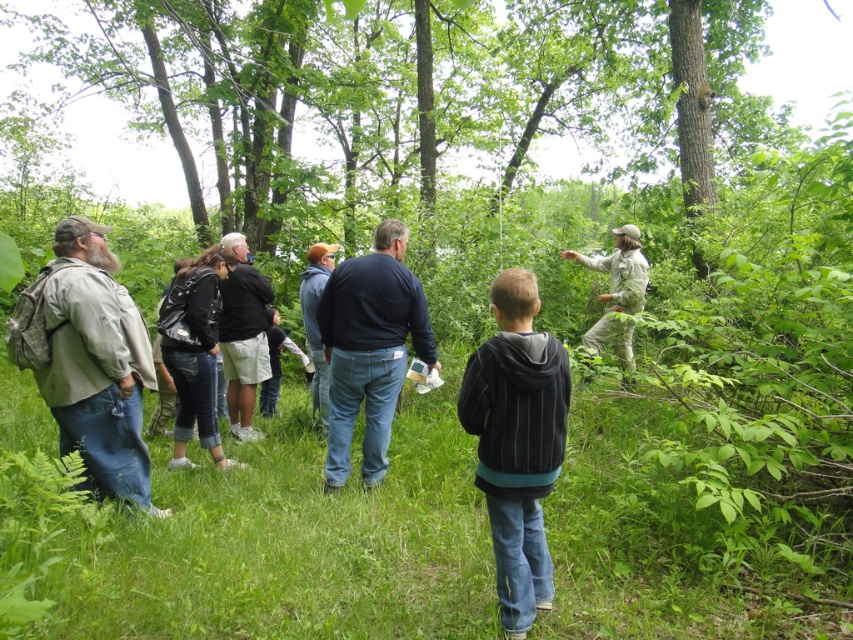
Question: Does black striped hoodie at center appear under blue denim jeans at center?

Choices:
 (A) yes
 (B) no

Answer: (A)

Question: Which of the following is the closest to the observer?

Choices:
 (A) blue denim jeans at center
 (B) camouflage backpack at left
 (C) khaki fabric jacket at center

Answer: (B)

Question: Is camouflage backpack at left closer to the viewer compared to blue denim jeans at center?

Choices:
 (A) no
 (B) yes

Answer: (B)

Question: Considering the real-world distances, which object is farthest from the camouflage backpack at left?

Choices:
 (A) black leather jacket at center
 (B) khaki fabric jacket at center
 (C) black striped hoodie at center

Answer: (B)

Question: Which of the following is the closest to the observer?

Choices:
 (A) black leather jacket at center
 (B) camouflage backpack at left
 (C) khaki fabric jacket at center

Answer: (B)

Question: Can you confirm if black striped hoodie at center is positioned below camouflage backpack at left?

Choices:
 (A) yes
 (B) no

Answer: (A)